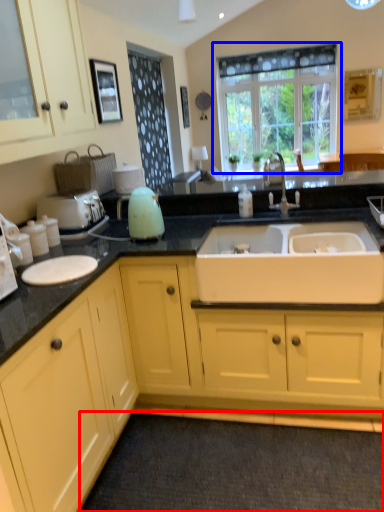
Question: Among these objects, which one is nearest to the camera, plain (highlighted by a red box) or window (highlighted by a blue box)?

Choices:
 (A) plain
 (B) window

Answer: (A)